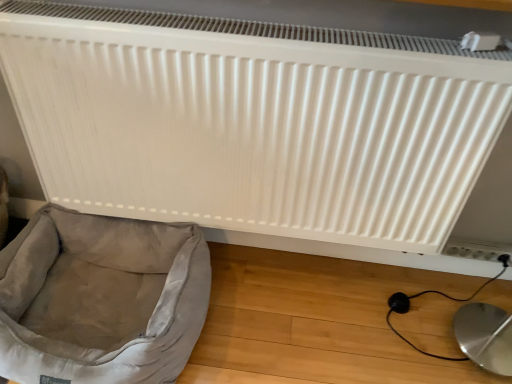
Measure the distance between white matte radiator at upper center and camera.

The depth of white matte radiator at upper center is 35.03 inches.

The height and width of the screenshot is (384, 512). Find the location of `white matte radiator at upper center`. white matte radiator at upper center is located at coordinates (254, 121).

Which object is positioned more to the right, light gray fabric dog bed at lower left or white matte radiator at upper center?

Positioned to the right is white matte radiator at upper center.

You are a GUI agent. You are given a task and a screenshot of the screen. Output one action in this format:
    pyautogui.click(x=<x>, y=<y>)
    Task: Click on the dog bed that appears on the left of white matte radiator at upper center
    
    Given the screenshot: What is the action you would take?
    pyautogui.click(x=101, y=299)

Is light gray fabric dog bed at lower left outside of white matte radiator at upper center?

Absolutely, light gray fabric dog bed at lower left is external to white matte radiator at upper center.

Based on the photo, can you confirm if light gray fabric dog bed at lower left is thinner than white matte radiator at upper center?

In fact, light gray fabric dog bed at lower left might be wider than white matte radiator at upper center.

Are light gray fabric dog bed at lower left and white plastic electric outlet at lower right far apart?

That's right, there is a large distance between light gray fabric dog bed at lower left and white plastic electric outlet at lower right.

What's the angular difference between light gray fabric dog bed at lower left and white plastic electric outlet at lower right's facing directions?

The angular difference between light gray fabric dog bed at lower left and white plastic electric outlet at lower right is 2.08 degrees.

Where is `dog bed below the white plastic electric outlet at lower right (from the image's perspective)`? The height and width of the screenshot is (384, 512). dog bed below the white plastic electric outlet at lower right (from the image's perspective) is located at coordinates (101, 299).

From a real-world perspective, is white matte radiator at upper center above or below white plastic electric outlet at lower right?

white matte radiator at upper center is above white plastic electric outlet at lower right.

Is point (206, 93) farther from camera compared to point (490, 255)?

No.

How many degrees apart are the facing directions of white matte radiator at upper center and white plastic electric outlet at lower right?

They differ by 0.491 degrees in their facing directions.

Does white matte radiator at upper center appear on the right side of white plastic electric outlet at lower right?

In fact, white matte radiator at upper center is to the left of white plastic electric outlet at lower right.

Which of these two, white plastic electric outlet at lower right or light gray fabric dog bed at lower left, stands taller?

light gray fabric dog bed at lower left is taller.

Is point (466, 250) in front of point (157, 268)?

No.

Is light gray fabric dog bed at lower left completely or partially inside white plastic electric outlet at lower right?

No.

From a real-world perspective, is white plastic electric outlet at lower right positioned under light gray fabric dog bed at lower left based on gravity?

Yes, from a real-world perspective, white plastic electric outlet at lower right is beneath light gray fabric dog bed at lower left.

Looking at this image, is white matte radiator at upper center not close to light gray fabric dog bed at lower left?

white matte radiator at upper center is near light gray fabric dog bed at lower left, not far away.

From the image's perspective, is white matte radiator at upper center on light gray fabric dog bed at lower left?

Correct, white matte radiator at upper center appears higher than light gray fabric dog bed at lower left in the image.

From a real-world perspective, which object rests below the other?

light gray fabric dog bed at lower left.

How distant is white matte radiator at upper center from light gray fabric dog bed at lower left?

A distance of 13.71 inches exists between white matte radiator at upper center and light gray fabric dog bed at lower left.

Who is shorter, white plastic electric outlet at lower right or white matte radiator at upper center?

white plastic electric outlet at lower right is shorter.

Would you consider white plastic electric outlet at lower right to be distant from white matte radiator at upper center?

They are positioned close to each other.

You are a GUI agent. You are given a task and a screenshot of the screen. Output one action in this format:
    pyautogui.click(x=<x>, y=<y>)
    Task: Click on the electric outlet behind the white matte radiator at upper center
    The width and height of the screenshot is (512, 384).
    Given the screenshot: What is the action you would take?
    pyautogui.click(x=477, y=250)

From the image's perspective, is white plastic electric outlet at lower right above or below white matte radiator at upper center?

white plastic electric outlet at lower right is situated lower than white matte radiator at upper center in the image.

Locate an element on the screen. radiator in front of the light gray fabric dog bed at lower left is located at coordinates (254, 121).

Locate an element on the screen. This screenshot has height=384, width=512. dog bed below the white plastic electric outlet at lower right (from the image's perspective) is located at coordinates (101, 299).

Estimate the real-world distances between objects in this image. Which object is further from light gray fabric dog bed at lower left, white matte radiator at upper center or white plastic electric outlet at lower right?

white plastic electric outlet at lower right.

Which object lies nearer to the anchor point white plastic electric outlet at lower right, light gray fabric dog bed at lower left or white matte radiator at upper center?

white matte radiator at upper center is positioned closer to the anchor white plastic electric outlet at lower right.

From the image, which object appears to be nearer to white matte radiator at upper center, white plastic electric outlet at lower right or light gray fabric dog bed at lower left?

light gray fabric dog bed at lower left lies closer to white matte radiator at upper center than the other object.

Considering their positions, is white matte radiator at upper center positioned closer to white plastic electric outlet at lower right than light gray fabric dog bed at lower left?

white matte radiator at upper center lies closer to white plastic electric outlet at lower right than the other object.

Looking at the image, which one is located closer to light gray fabric dog bed at lower left, white plastic electric outlet at lower right or white matte radiator at upper center?

white matte radiator at upper center lies closer to light gray fabric dog bed at lower left than the other object.

Looking at the image, which one is located further to white matte radiator at upper center, light gray fabric dog bed at lower left or white plastic electric outlet at lower right?

white plastic electric outlet at lower right lies further to white matte radiator at upper center than the other object.

The width and height of the screenshot is (512, 384). I want to click on radiator situated between light gray fabric dog bed at lower left and white plastic electric outlet at lower right from left to right, so click(x=254, y=121).